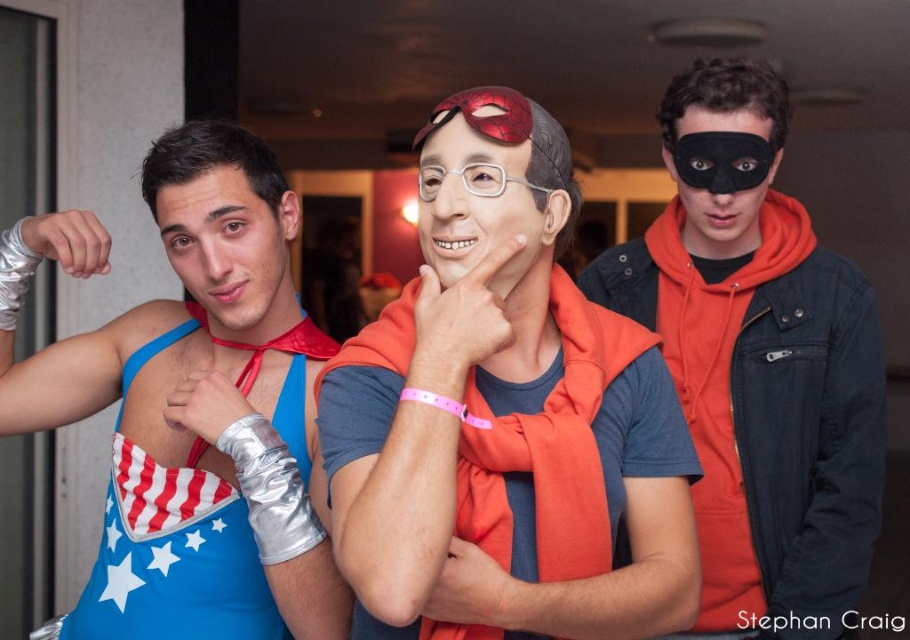
This screenshot has height=640, width=910. What do you see at coordinates (231, 250) in the screenshot?
I see `matte blue tank top at left` at bounding box center [231, 250].

Does matte blue tank top at left have a smaller size compared to black matte mask at center?

Correct, matte blue tank top at left occupies less space than black matte mask at center.

What do you see at coordinates (231, 250) in the screenshot? I see `matte blue tank top at left` at bounding box center [231, 250].

The image size is (910, 640). Find the location of `matte blue tank top at left`. matte blue tank top at left is located at coordinates (231, 250).

Can you confirm if matte red scarf at center is thinner than black matte mask at upper right?

Yes, matte red scarf at center is thinner than black matte mask at upper right.

Which is in front, point (672, 561) or point (830, 636)?

Point (672, 561)

This screenshot has height=640, width=910. I want to click on matte red scarf at center, so click(x=504, y=417).

Is black matte mask at upper right shorter than shiny red goggles at center?

No.

Does black matte mask at upper right appear over shiny red goggles at center?

Actually, black matte mask at upper right is below shiny red goggles at center.

This screenshot has width=910, height=640. I want to click on black matte mask at upper right, so click(760, 371).